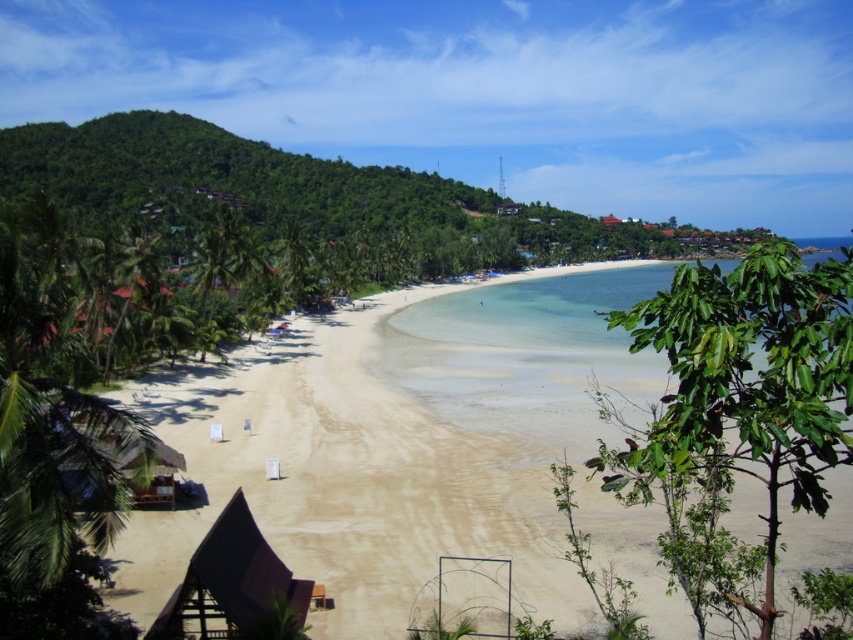
Question: Which object is farther from the camera taking this photo?

Choices:
 (A) brown wooden hut at lower left
 (B) white sand beach at center

Answer: (B)

Question: Does white sand beach at center lie in front of green leafy palm tree at right?

Choices:
 (A) no
 (B) yes

Answer: (A)

Question: Estimate the real-world distances between objects in this image. Which object is closer to the brown wooden hut at lower left?

Choices:
 (A) green leafy palm tree at right
 (B) white sand beach at center

Answer: (A)

Question: Is green leafy palm tree at right to the left of brown wooden hut at lower left from the viewer's perspective?

Choices:
 (A) no
 (B) yes

Answer: (A)

Question: Which point is closer to the camera taking this photo?

Choices:
 (A) (393, 332)
 (B) (265, 605)

Answer: (B)

Question: Is white sand beach at center to the left of green leafy palm tree at right from the viewer's perspective?

Choices:
 (A) no
 (B) yes

Answer: (A)